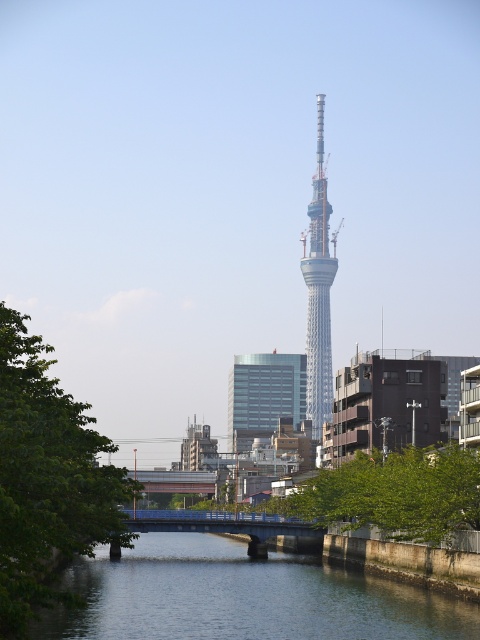
You are standing in front of the silver metallic tower at center and want to cross to the other side of the clear water at center. Is the bridge visible from your current position?

The clear water at center is closer to the viewer than the silver metallic tower at center. Since the water is in front of the tower, the bridge spanning the water would be visible as you face the tower.

You are standing at the base of the Tokyo Skytree and see the point marked at coordinates (241, 596). What is the most likely feature you are looking at?

The point at (241, 596) indicates clear water at center, so you are looking at the calm waterway reflecting the sky and surrounding buildings.

You are standing at the base of the silver metallic tower at center and want to walk to the green leafy tree at lower left. Which direction should you head to reach it?

The green leafy tree at lower left is closer to the viewer than the silver metallic tower at center, so you should head towards the direction where the tree is located, which is to your left side from the tower.